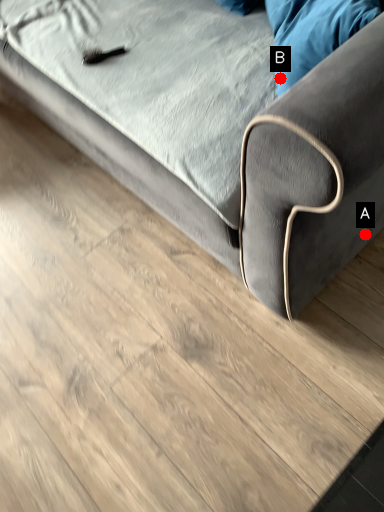
Question: Two points are circled on the image, labeled by A and B beside each circle. Which point is closer to the camera?

Choices:
 (A) A is closer
 (B) B is closer

Answer: (B)